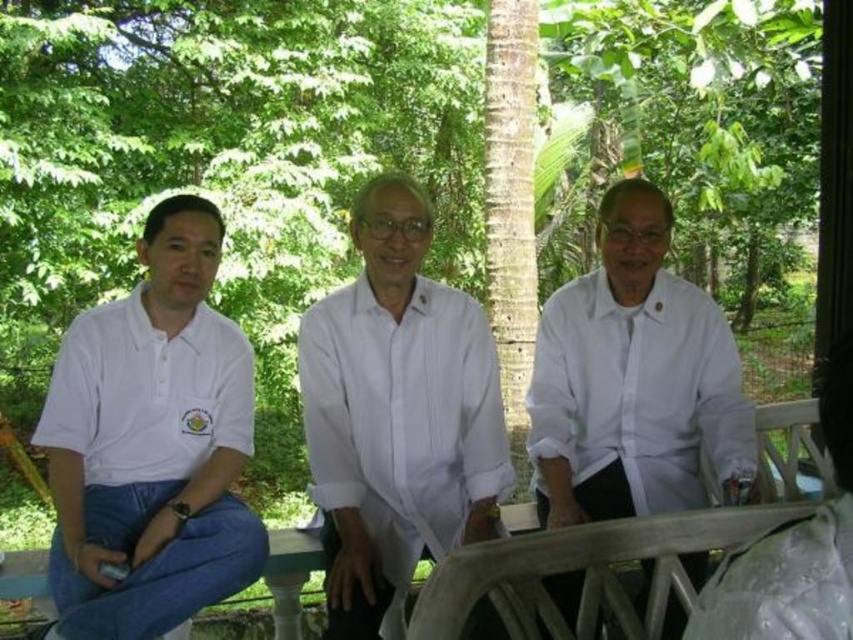
You are a photographer trying to capture a group photo of the three people in the scene. The two individuals wearing white matte shirts are positioned at center and left. Given that your camera has a focus range of 3 feet, can you ensure both the white matte shirt at center and the white matte polo shirt at left are in focus simultaneously?

The white matte shirt at center and the white matte polo shirt at left are 3.74 feet apart from each other. Since the camera has a focus range of 3 feet, the distance between them exceeds the focus range. Therefore, both cannot be in focus at the same time.